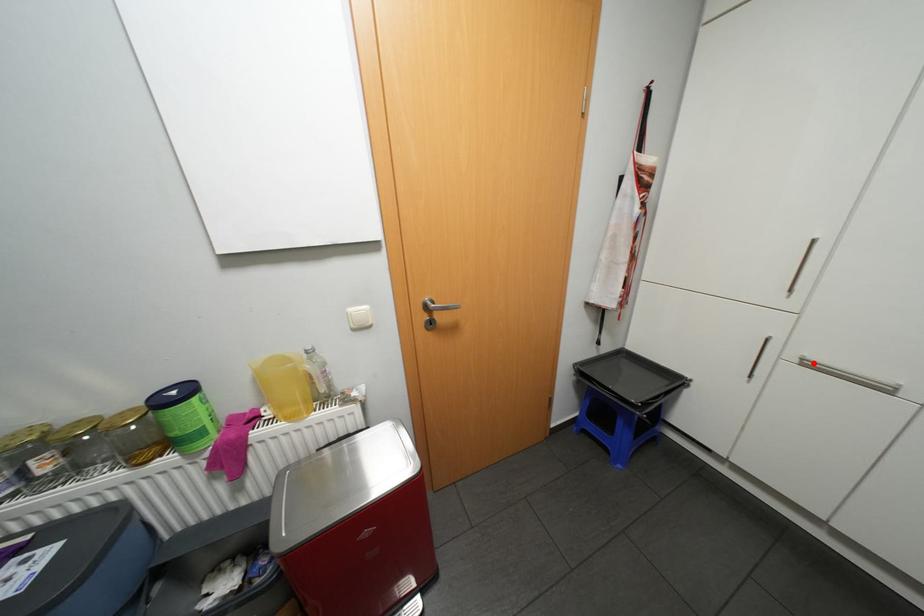
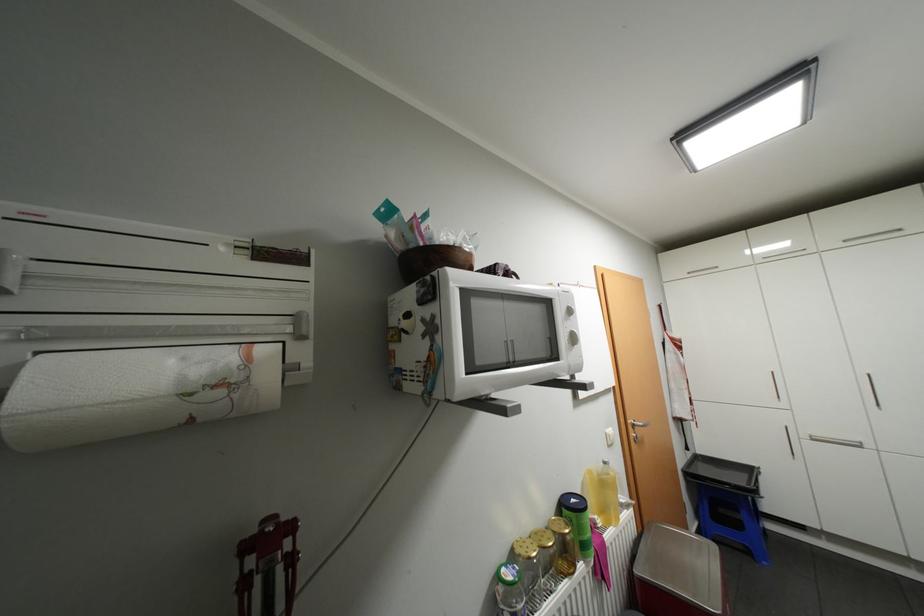
In the second image, find the point that corresponds to the highlighted location in the first image.

(821, 438)